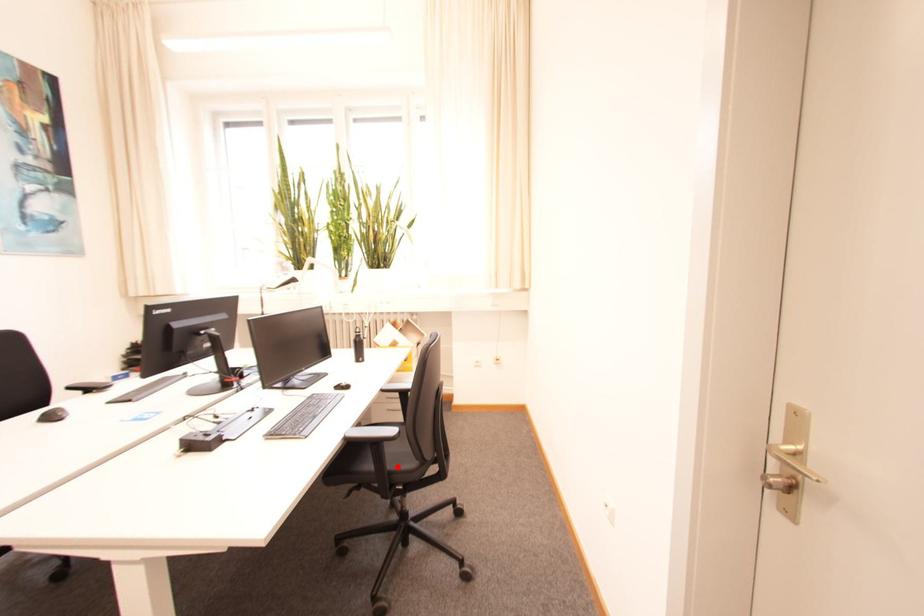
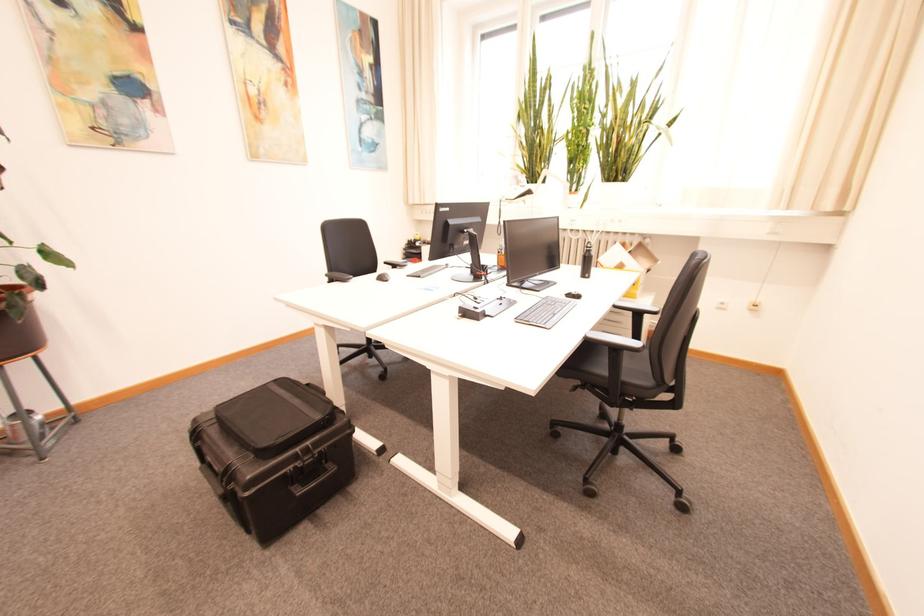
The point at the highlighted location is marked in the first image. Where is the corresponding point in the second image?

(631, 377)